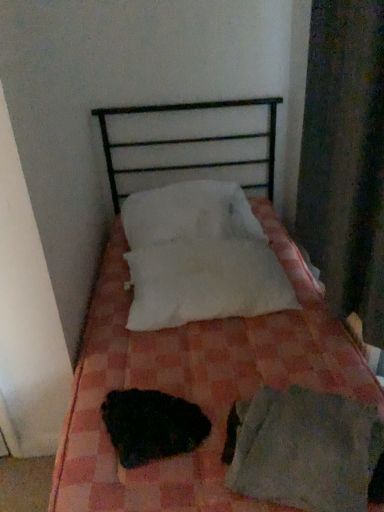
Question: Is there a large distance between white fluffy pillow at center, acting as the second pillow starting from the top, and pink checkered bed at center?

Choices:
 (A) yes
 (B) no

Answer: (B)

Question: From a real-world perspective, is white fluffy pillow at center, acting as the second pillow starting from the top, on pink checkered bed at center?

Choices:
 (A) yes
 (B) no

Answer: (A)

Question: Is pink checkered bed at center located within white fluffy pillow at center, which ranks as the 1th pillow in bottom-to-top order?

Choices:
 (A) yes
 (B) no

Answer: (B)

Question: Does white fluffy pillow at center, acting as the second pillow starting from the top, have a smaller size compared to pink checkered bed at center?

Choices:
 (A) no
 (B) yes

Answer: (B)

Question: From the image's perspective, does white fluffy pillow at center, which ranks as the 1th pillow in bottom-to-top order, appear higher than pink checkered bed at center?

Choices:
 (A) no
 (B) yes

Answer: (B)

Question: Would you say white fluffy pillow at center, acting as the second pillow starting from the top, is inside or outside pink checkered bed at center?

Choices:
 (A) outside
 (B) inside

Answer: (B)

Question: Based on their positions, is white fluffy pillow at center, acting as the second pillow starting from the top, located to the left or right of pink checkered bed at center?

Choices:
 (A) right
 (B) left

Answer: (B)

Question: Is white fluffy pillow at center, acting as the second pillow starting from the top, wider or thinner than pink checkered bed at center?

Choices:
 (A) wide
 (B) thin

Answer: (B)

Question: Does point (201, 292) appear closer or farther from the camera than point (261, 382)?

Choices:
 (A) farther
 (B) closer

Answer: (A)

Question: Based on their positions, is white fluffy pillow at center, acting as the second pillow starting from the top, located to the left or right of light gray cotton sheet at lower right?

Choices:
 (A) left
 (B) right

Answer: (A)

Question: Is white fluffy pillow at center, acting as the second pillow starting from the top, bigger or smaller than light gray cotton sheet at lower right?

Choices:
 (A) small
 (B) big

Answer: (B)

Question: Is white fluffy pillow at center, which ranks as the 1th pillow in bottom-to-top order, taller or shorter than light gray cotton sheet at lower right?

Choices:
 (A) tall
 (B) short

Answer: (A)

Question: Is white fluffy pillow at center, acting as the second pillow starting from the top, inside or outside of light gray cotton sheet at lower right?

Choices:
 (A) inside
 (B) outside

Answer: (B)

Question: In terms of size, does white fluffy pillow at center, which ranks as the 1th pillow in bottom-to-top order, appear bigger or smaller than white soft pillow at center, which ranks as the 1th pillow in top-to-bottom order?

Choices:
 (A) small
 (B) big

Answer: (A)

Question: Is white fluffy pillow at center, acting as the second pillow starting from the top, spatially inside white soft pillow at center, which ranks as the 1th pillow in top-to-bottom order, or outside of it?

Choices:
 (A) outside
 (B) inside

Answer: (A)